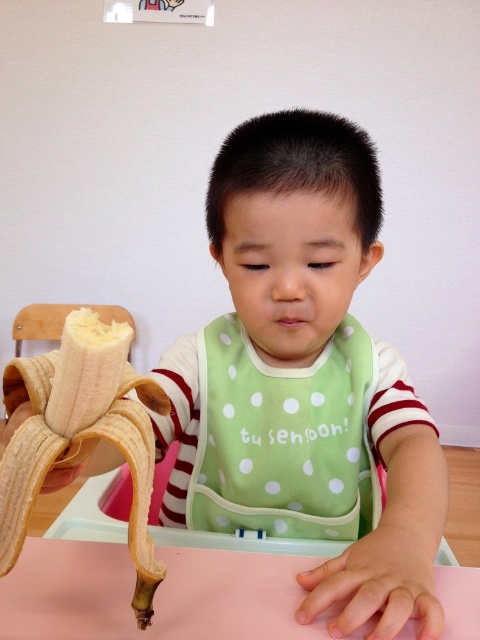
You are a parent trying to place a small toy on the table. Given that the pink matte table at lower center is wider than the yellow matte banana at lower left, can you fit the toy on the table if the toy is the same size as the banana?

Yes, the pink matte table at lower center has a larger width than the yellow matte banana at lower left, so the toy can fit on the table since it is the same size as the banana.